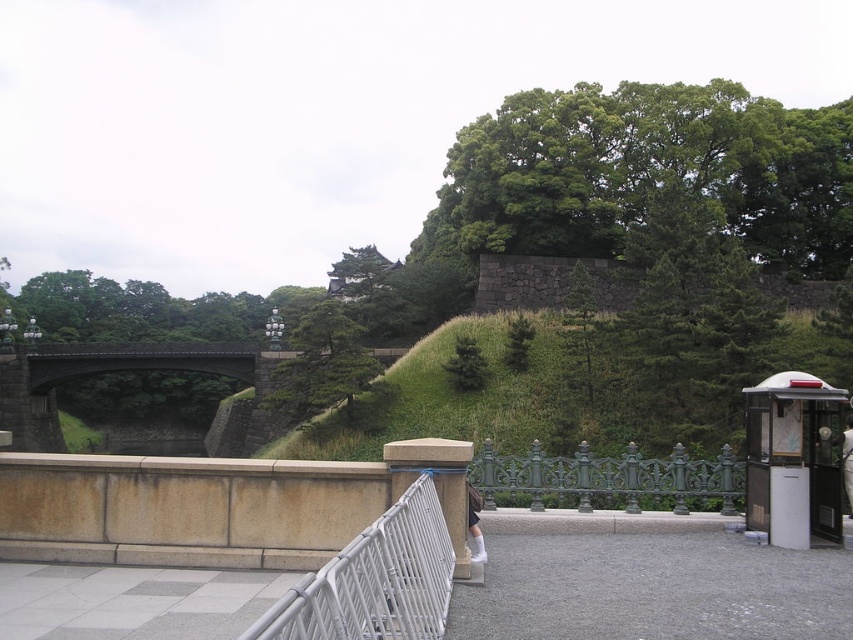
Question: Does dark gray stone bridge at center have a smaller size compared to green cast iron fence at center?

Choices:
 (A) no
 (B) yes

Answer: (A)

Question: Which is farther from the dark gray stone bridge at center?

Choices:
 (A) green cast iron fence at center
 (B) white metal fence at center

Answer: (B)

Question: Is dark gray stone bridge at center positioned at the back of green cast iron fence at center?

Choices:
 (A) no
 (B) yes

Answer: (B)

Question: Based on their relative distances, which object is nearer to the green cast iron fence at center?

Choices:
 (A) dark gray stone bridge at center
 (B) white metal fence at center

Answer: (B)

Question: Is white metal fence at center to the left of dark gray stone bridge at center from the viewer's perspective?

Choices:
 (A) yes
 (B) no

Answer: (B)

Question: Which point is farther to the camera?

Choices:
 (A) green cast iron fence at center
 (B) dark gray stone bridge at center

Answer: (B)